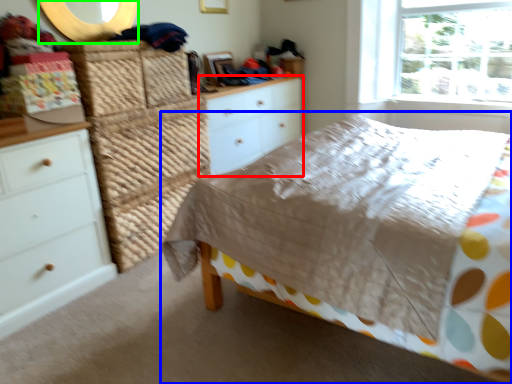
Question: Considering the real-world distances, which object is closest to chest of drawers (highlighted by a red box)? bed (highlighted by a blue box) or mirror (highlighted by a green box).

Choices:
 (A) bed
 (B) mirror

Answer: (B)